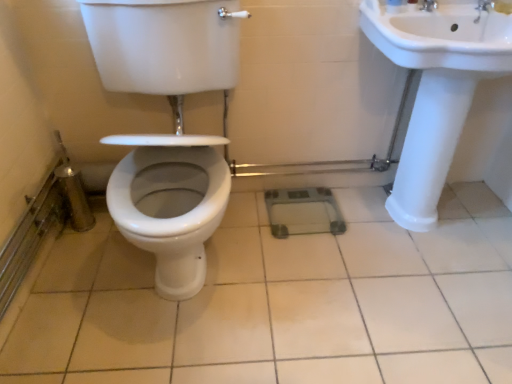
Find the location of a particular element. The height and width of the screenshot is (384, 512). vacant space underneath white glossy sink at right (from a real-world perspective) is located at coordinates (419, 231).